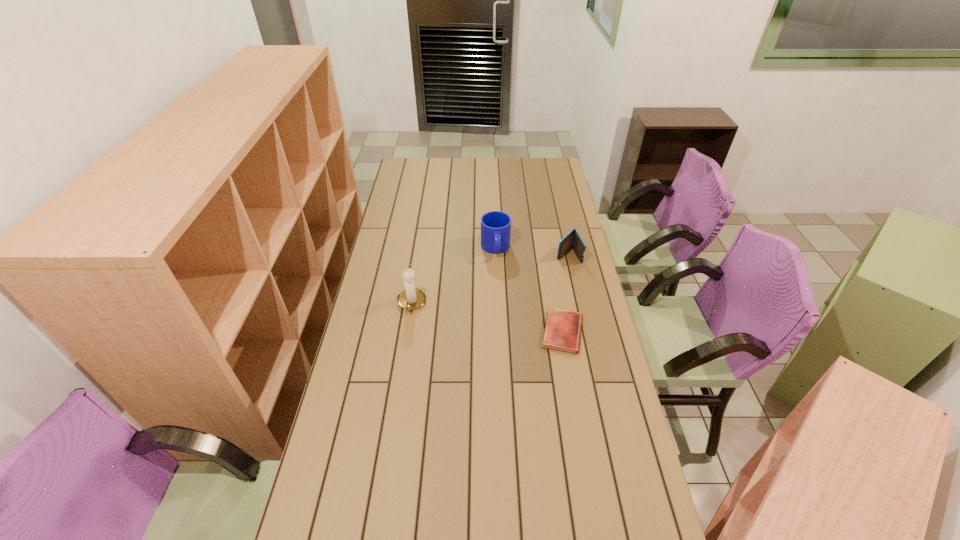
Find the location of `free spot on the desktop that is between the tallest object and the diary and is positioned on the side with the handle of the mug`. free spot on the desktop that is between the tallest object and the diary and is positioned on the side with the handle of the mug is located at coordinates (504, 320).

I want to click on vacant space on the desktop that is between the leftmost object and the shortest object and is positioned on the exterior surface of the wallet, so click(x=499, y=320).